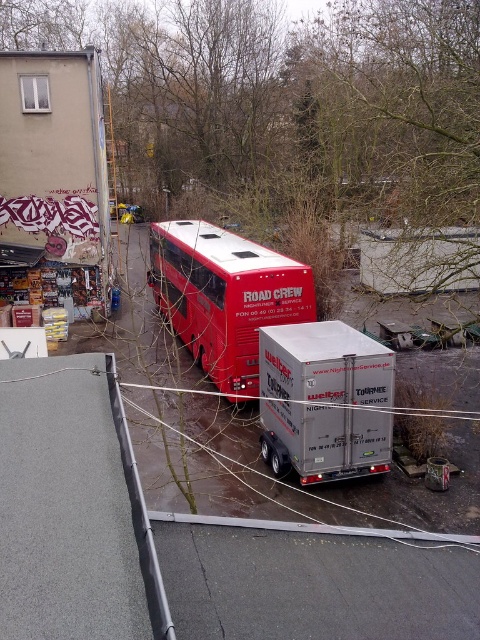
Is silver metallic trailer at center taller than shiny red bus at center?

Incorrect, silver metallic trailer at center's height is not larger of shiny red bus at center's.

Between point (349, 340) and point (228, 248), which one is positioned in front?

Positioned in front is point (349, 340).

The height and width of the screenshot is (640, 480). I want to click on silver metallic trailer at center, so click(x=324, y=401).

Where is `silver metallic trailer at center`? Image resolution: width=480 pixels, height=640 pixels. silver metallic trailer at center is located at coordinates (324, 401).